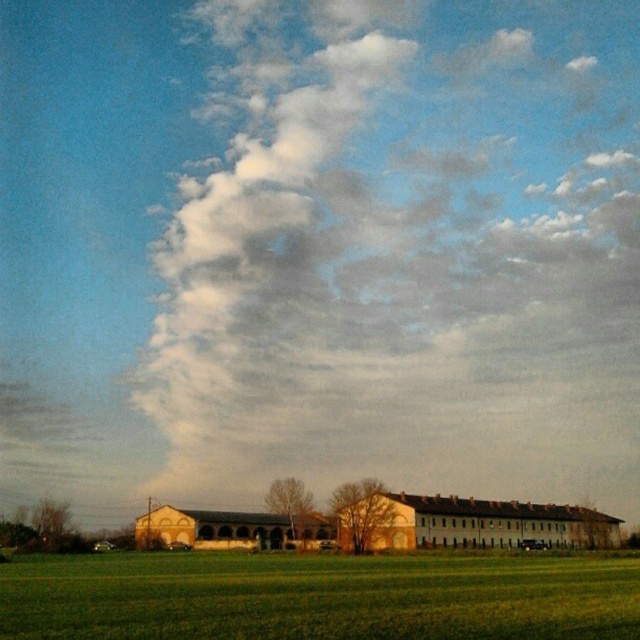
Question: Is the position of white fluffy cloud at upper center more distant than that of beige brick barn at center?

Choices:
 (A) yes
 (B) no

Answer: (A)

Question: Is green grass at lower center behind brown textured barn at center?

Choices:
 (A) no
 (B) yes

Answer: (A)

Question: Which point is farther to the camera?

Choices:
 (A) beige brick barn at center
 (B) brown textured barn at center

Answer: (B)

Question: Where is beige brick barn at center located in relation to brown textured barn at center in the image?

Choices:
 (A) below
 (B) above

Answer: (B)

Question: Which of the following is the farthest from the observer?

Choices:
 (A) (490, 520)
 (B) (189, 538)

Answer: (A)

Question: Which of the following is the closest to the observer?

Choices:
 (A) brown textured barn at center
 (B) beige brick barn at center

Answer: (B)